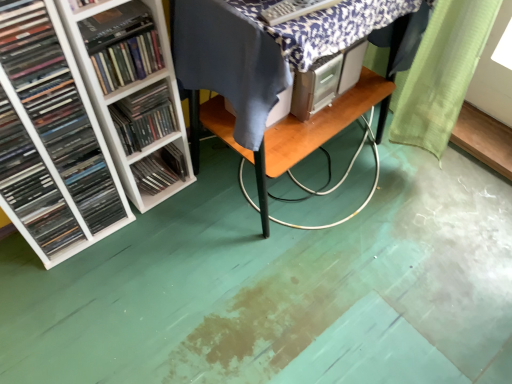
What are the coordinates of `unoccupied area in front of white plastic shelves at left, which is counted as the second book, starting from the left` in the screenshot? It's located at (68, 293).